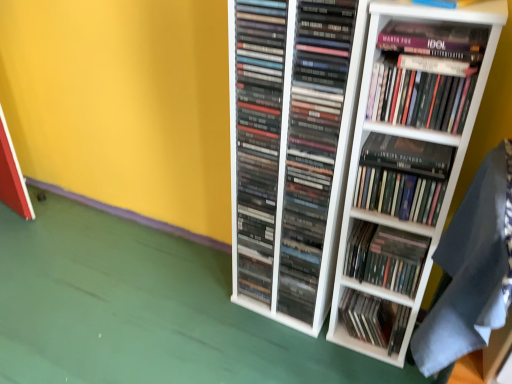
Where is `vacant space in front of matte black books at center, acting as the 3th book starting from the bottom`? vacant space in front of matte black books at center, acting as the 3th book starting from the bottom is located at coordinates (303, 351).